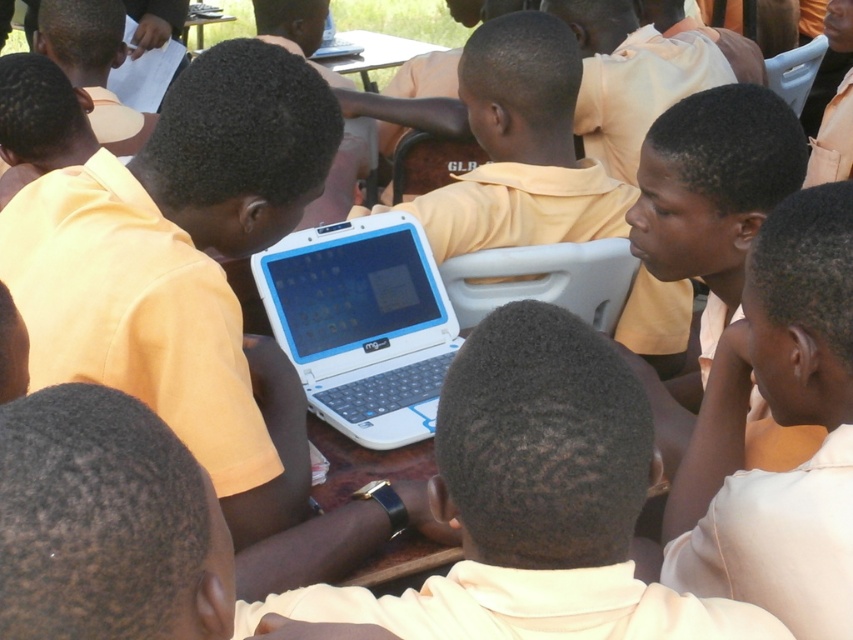
Which is above, white plastic laptop at center or white plastic table at upper center?

Positioned higher is white plastic table at upper center.

Can you confirm if white plastic laptop at center is positioned to the left of white plastic table at upper center?

Incorrect, white plastic laptop at center is not on the left side of white plastic table at upper center.

This screenshot has height=640, width=853. What are the coordinates of `white plastic laptop at center` in the screenshot? It's located at (363, 324).

The height and width of the screenshot is (640, 853). Find the location of `white plastic laptop at center`. white plastic laptop at center is located at coordinates (363, 324).

Between matte yellow shirt at right and white plastic laptop at upper center, which one is positioned higher?

white plastic laptop at upper center is higher up.

Is matte yellow shirt at right bigger than white plastic laptop at upper center?

Correct, matte yellow shirt at right is larger in size than white plastic laptop at upper center.

Which is behind, point (809, 556) or point (326, 42)?

The point (326, 42) is behind.

This screenshot has width=853, height=640. What are the coordinates of `matte yellow shirt at right` in the screenshot? It's located at (781, 424).

Is white plastic table at upper center closer to camera compared to white plastic laptop at upper center?

Yes, white plastic table at upper center is in front of white plastic laptop at upper center.

Looking at this image, is white plastic table at upper center below white plastic laptop at upper center?

Yes.

Is point (357, 72) positioned before point (329, 33)?

That is True.

This screenshot has width=853, height=640. Identify the location of white plastic table at upper center. (375, 54).